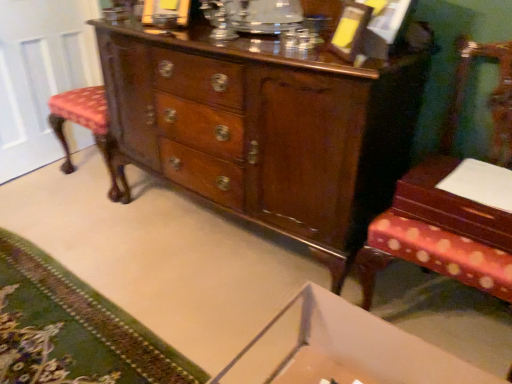
Question: Could you tell me if mahogany wood table at right is turned towards white glossy door at left?

Choices:
 (A) yes
 (B) no

Answer: (B)

Question: Does mahogany wood table at right have a smaller size compared to white glossy door at left?

Choices:
 (A) yes
 (B) no

Answer: (A)

Question: From a real-world perspective, is mahogany wood table at right over white glossy door at left?

Choices:
 (A) yes
 (B) no

Answer: (A)

Question: Are mahogany wood table at right and white glossy door at left far apart?

Choices:
 (A) yes
 (B) no

Answer: (A)

Question: Is white glossy door at left surrounded by mahogany wood table at right?

Choices:
 (A) no
 (B) yes

Answer: (A)

Question: From the image's perspective, is white glossy door at left located above or below green carpet at lower left?

Choices:
 (A) below
 (B) above

Answer: (B)

Question: In terms of height, does white glossy door at left look taller or shorter compared to green carpet at lower left?

Choices:
 (A) short
 (B) tall

Answer: (B)

Question: Is point (15, 137) positioned closer to the camera than point (34, 256)?

Choices:
 (A) farther
 (B) closer

Answer: (A)

Question: Is white glossy door at left wider or thinner than green carpet at lower left?

Choices:
 (A) wide
 (B) thin

Answer: (B)

Question: Considering the positions of point (499, 155) and point (193, 150), is point (499, 155) closer or farther from the camera than point (193, 150)?

Choices:
 (A) closer
 (B) farther

Answer: (A)

Question: In terms of width, does wooden chair with patterned cushion at right look wider or thinner when compared to shiny brown wood chest of drawers at center?

Choices:
 (A) wide
 (B) thin

Answer: (A)

Question: Looking at the image, does wooden chair with patterned cushion at right seem bigger or smaller compared to shiny brown wood chest of drawers at center?

Choices:
 (A) big
 (B) small

Answer: (B)

Question: Would you say wooden chair with patterned cushion at right is to the left or to the right of shiny brown wood chest of drawers at center in the picture?

Choices:
 (A) right
 (B) left

Answer: (A)

Question: Considering the positions of green carpet at lower left and mahogany wood table at right in the image, is green carpet at lower left taller or shorter than mahogany wood table at right?

Choices:
 (A) tall
 (B) short

Answer: (B)

Question: Is green carpet at lower left situated inside mahogany wood table at right or outside?

Choices:
 (A) outside
 (B) inside

Answer: (A)